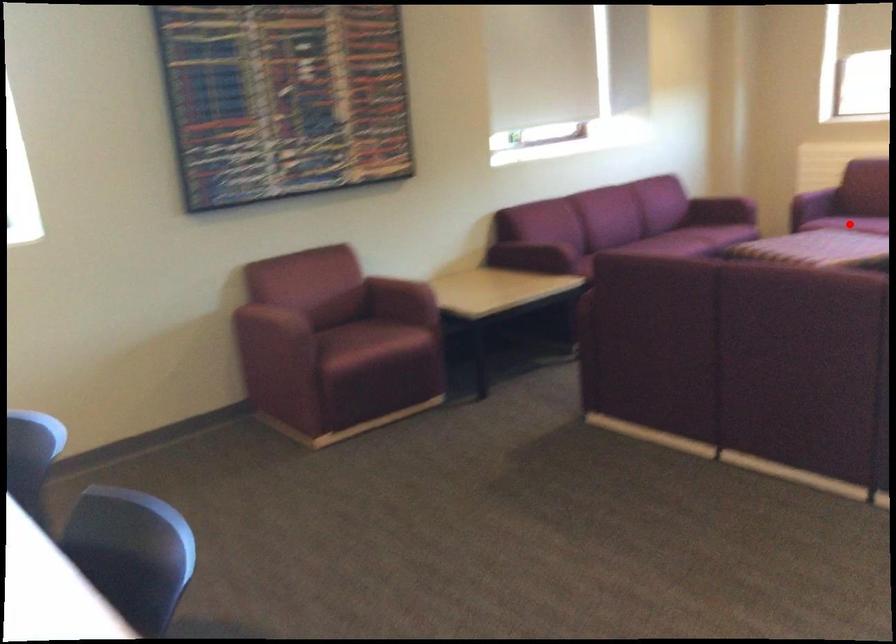
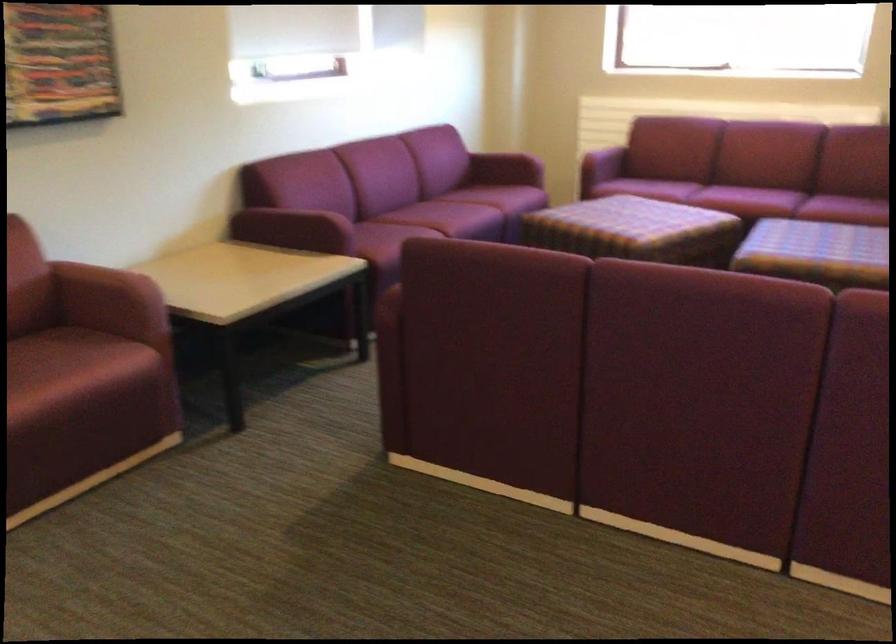
Question: I am providing you with two images of the same scene from different viewpoints. A red point is marked on the first image. Can you still see the location of the red point in image 2?

Choices:
 (A) Yes
 (B) No

Answer: (B)